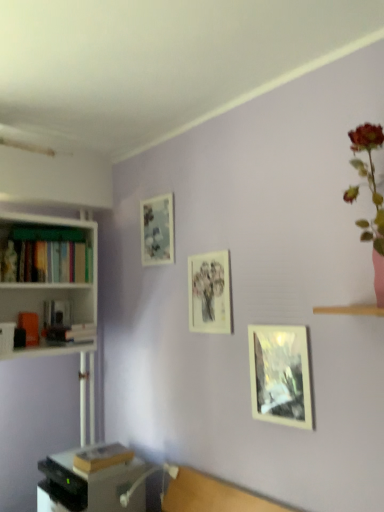
Question: Is the position of hardcover book at left, acting as the 2th book starting from the top, more distant than that of matte glass picture frame at upper left, arranged as the 3th picture frame when ordered from the bottom?

Choices:
 (A) yes
 (B) no

Answer: (B)

Question: Does hardcover book at left, acting as the 2th book starting from the top, have a smaller size compared to matte glass picture frame at upper left, positioned as the third picture frame in front-to-back order?

Choices:
 (A) no
 (B) yes

Answer: (A)

Question: From the image's perspective, is hardcover book at left, acting as the second book starting from the bottom, above matte glass picture frame at upper left, arranged as the 3th picture frame when ordered from the bottom?

Choices:
 (A) no
 (B) yes

Answer: (A)

Question: Is hardcover book at left, acting as the second book starting from the bottom, closer to the viewer compared to matte glass picture frame at upper left, positioned as the 1th picture frame in top-to-bottom order?

Choices:
 (A) yes
 (B) no

Answer: (A)

Question: Can you confirm if hardcover book at left, acting as the 2th book starting from the top, is positioned to the right of matte glass picture frame at upper left, which ranks as the third picture frame in right-to-left order?

Choices:
 (A) yes
 (B) no

Answer: (B)

Question: Is hardcover book at left, acting as the second book starting from the bottom, facing away from matte glass picture frame at upper left, arranged as the 3th picture frame when ordered from the bottom?

Choices:
 (A) no
 (B) yes

Answer: (A)

Question: Is hardcover books at left, acting as the 1th book starting from the top, in front of matte paper picture frame at center, which is counted as the 2th picture frame, starting from the right?

Choices:
 (A) no
 (B) yes

Answer: (A)

Question: Can you confirm if hardcover books at left, positioned as the third book in bottom-to-top order, is smaller than matte paper picture frame at center, the 2th picture frame viewed from the front?

Choices:
 (A) yes
 (B) no

Answer: (B)

Question: From a real-world perspective, is hardcover books at left, acting as the 1th book starting from the top, over matte paper picture frame at center, marked as the 2th picture frame in a back-to-front arrangement?

Choices:
 (A) yes
 (B) no

Answer: (A)

Question: From the image's perspective, is hardcover books at left, acting as the 1th book starting from the top, located beneath matte paper picture frame at center, marked as the 2th picture frame in a back-to-front arrangement?

Choices:
 (A) no
 (B) yes

Answer: (A)

Question: From a real-world perspective, does hardcover books at left, positioned as the third book in bottom-to-top order, sit lower than matte paper picture frame at center, which is counted as the 2th picture frame, starting from the right?

Choices:
 (A) no
 (B) yes

Answer: (A)

Question: Can you confirm if hardcover books at left, positioned as the third book in bottom-to-top order, is taller than matte paper picture frame at center, the second picture frame in the left-to-right sequence?

Choices:
 (A) no
 (B) yes

Answer: (A)

Question: Is matte paper picture frame at center, marked as the 2th picture frame in a back-to-front arrangement, not inside matte glass picture frame at upper left, arranged as the first picture frame when viewed from the back?

Choices:
 (A) yes
 (B) no

Answer: (A)